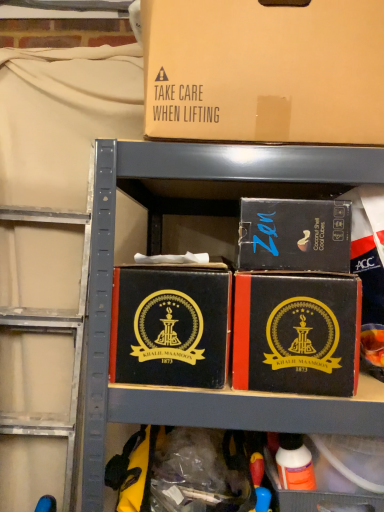
Question: Which direction should I rotate to face brown cardboard box at upper center, the 4th box ordered from the bottom, — up or down?

Choices:
 (A) down
 (B) up

Answer: (B)

Question: Does black leather box at center, the third box viewed from the top, have a smaller size compared to black cardboard box at center, which appears as the first box when ordered from the bottom?

Choices:
 (A) yes
 (B) no

Answer: (B)

Question: Is black leather box at center, which ranks as the 2th box in bottom-to-top order, positioned behind black cardboard box at center, the fourth box in the top-to-bottom sequence?

Choices:
 (A) yes
 (B) no

Answer: (B)

Question: Is black leather box at center, which ranks as the 2th box in bottom-to-top order, placed right next to black cardboard box at center, the fourth box in the top-to-bottom sequence?

Choices:
 (A) no
 (B) yes

Answer: (B)

Question: Is black leather box at center, the third box viewed from the top, aimed at black cardboard box at center, which appears as the first box when ordered from the bottom?

Choices:
 (A) no
 (B) yes

Answer: (A)

Question: From the image's perspective, is black leather box at center, the third box viewed from the top, below black cardboard box at center, the fourth box in the top-to-bottom sequence?

Choices:
 (A) yes
 (B) no

Answer: (B)

Question: Is black cardboard box at center, the fourth box in the top-to-bottom sequence, completely or partially inside black leather box at center, which ranks as the 2th box in bottom-to-top order?

Choices:
 (A) no
 (B) yes

Answer: (A)

Question: Is black cardboard box at center, placed as the 3th box when sorted from bottom to top, bigger than brown cardboard box at upper center, marked as the first box in a top-to-bottom arrangement?

Choices:
 (A) yes
 (B) no

Answer: (B)

Question: Is black cardboard box at center, acting as the 2th box starting from the top, positioned with its back to brown cardboard box at upper center, marked as the first box in a top-to-bottom arrangement?

Choices:
 (A) yes
 (B) no

Answer: (B)

Question: Is black cardboard box at center, acting as the 2th box starting from the top, shorter than brown cardboard box at upper center, marked as the first box in a top-to-bottom arrangement?

Choices:
 (A) no
 (B) yes

Answer: (B)

Question: From the image's perspective, is black cardboard box at center, placed as the 3th box when sorted from bottom to top, on top of brown cardboard box at upper center, the 4th box ordered from the bottom?

Choices:
 (A) no
 (B) yes

Answer: (A)

Question: Is the depth of black cardboard box at center, placed as the 3th box when sorted from bottom to top, less than that of brown cardboard box at upper center, marked as the first box in a top-to-bottom arrangement?

Choices:
 (A) yes
 (B) no

Answer: (B)

Question: Are black cardboard box at center, placed as the 3th box when sorted from bottom to top, and brown cardboard box at upper center, the 4th box ordered from the bottom, making contact?

Choices:
 (A) no
 (B) yes

Answer: (A)

Question: From the image's perspective, is black cardboard box at center, which appears as the first box when ordered from the bottom, on top of black cardboard box at center, placed as the 3th box when sorted from bottom to top?

Choices:
 (A) yes
 (B) no

Answer: (B)